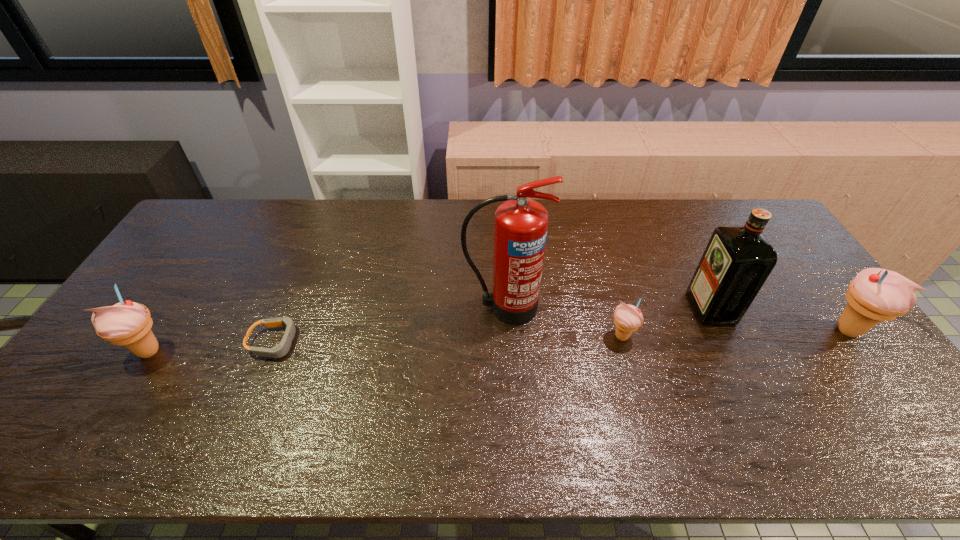
At what (x,y) coordinates should I click in order to perform the action: click on vacant region between the second tallest object and the rightmost object. Please return your answer as a coordinate pair (x, y). The height and width of the screenshot is (540, 960). Looking at the image, I should click on (780, 319).

You are a GUI agent. You are given a task and a screenshot of the screen. Output one action in this format:
    pyautogui.click(x=<x>, y=<y>)
    Task: Click on the vacant area that lies between the shortest icecream and the second object from left to right
    Image resolution: width=960 pixels, height=540 pixels.
    Given the screenshot: What is the action you would take?
    pyautogui.click(x=448, y=339)

Where is `free spot between the leftmost icecream and the fourth object from left to right`? Image resolution: width=960 pixels, height=540 pixels. free spot between the leftmost icecream and the fourth object from left to right is located at coordinates (385, 344).

Where is `free space between the rightmost icecream and the second tallest object`? The image size is (960, 540). free space between the rightmost icecream and the second tallest object is located at coordinates (780, 319).

Locate an element on the screen. The width and height of the screenshot is (960, 540). empty space between the fourth object from right to left and the fifth shortest object is located at coordinates (608, 307).

Identify which object is the second nearest to the third shortest object. Please provide its 2D coordinates. Your answer should be formatted as a tuple, i.e. [(x, y)], where the tuple contains the x and y coordinates of a point satisfying the conditions above.

[(520, 228)]

You are a GUI agent. You are given a task and a screenshot of the screen. Output one action in this format:
    pyautogui.click(x=<x>, y=<y>)
    Task: Click on the object identified as the third closest to the second icecream from right to left
    
    Given the screenshot: What is the action you would take?
    pyautogui.click(x=875, y=295)

Identify which icecream is located as the nearest to the fifth shortest object. Please provide its 2D coordinates. Your answer should be formatted as a tuple, i.e. [(x, y)], where the tuple contains the x and y coordinates of a point satisfying the conditions above.

[(627, 318)]

You are a GUI agent. You are given a task and a screenshot of the screen. Output one action in this format:
    pyautogui.click(x=<x>, y=<y>)
    Task: Click on the icecream that is the closest one to the second icecream from left to right
    
    Given the screenshot: What is the action you would take?
    pyautogui.click(x=875, y=295)

Where is `vacant region that satisfies the following two spatial constraints: 1. on the front and back of the goggles; 2. on the front side of the second shortest icecream`? vacant region that satisfies the following two spatial constraints: 1. on the front and back of the goggles; 2. on the front side of the second shortest icecream is located at coordinates (272, 351).